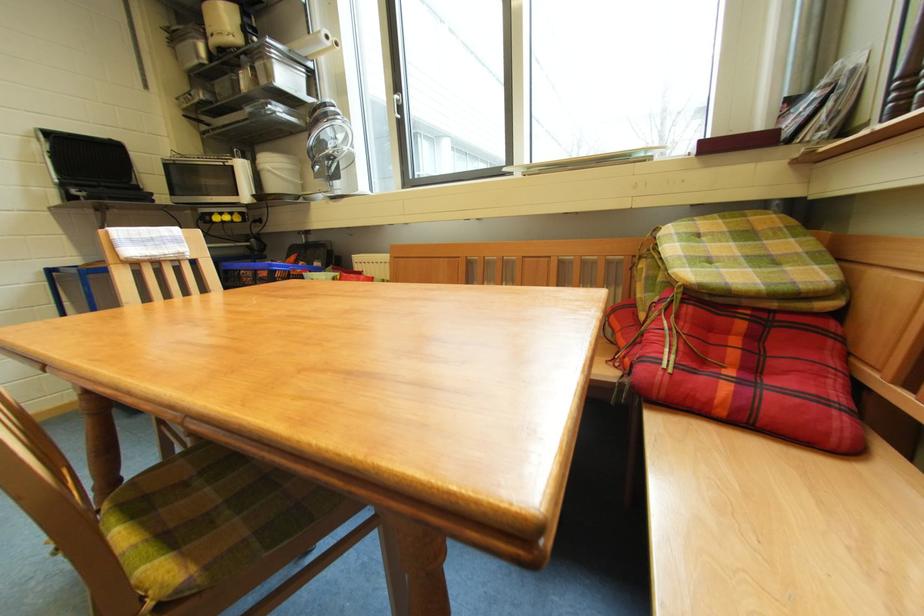
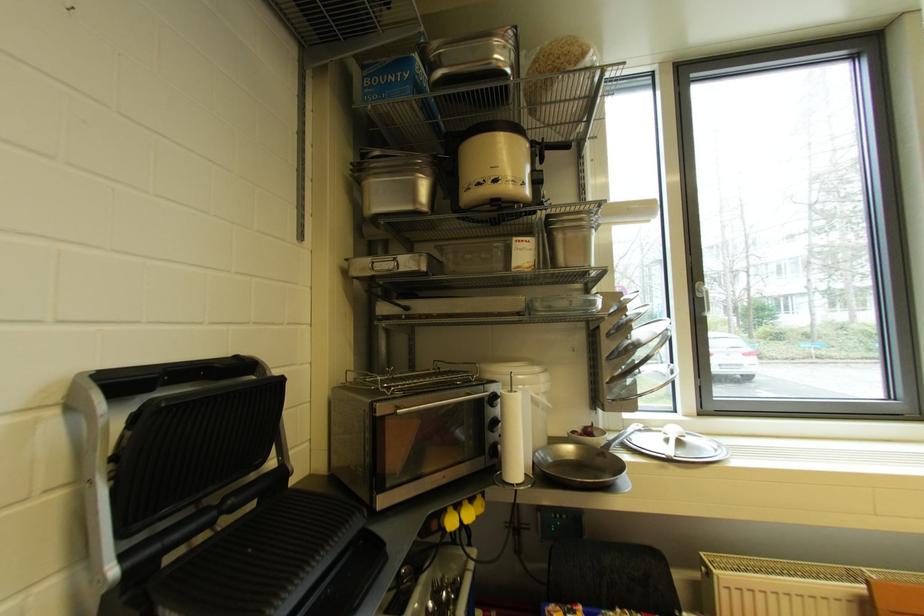
Where in the second image is the point corresponding to (204,65) from the first image?

(418, 211)